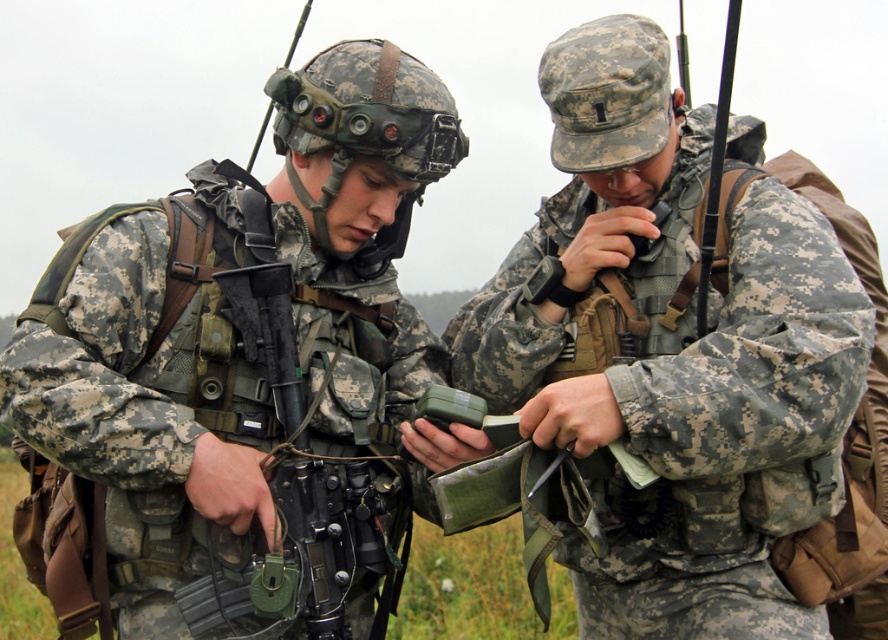
Question: Which is farther from the camouflage fabric radio at center?

Choices:
 (A) black matte rifle at center
 (B) camouflage uniform at center

Answer: (A)

Question: Can you confirm if camouflage fabric radio at center is positioned to the left of black matte rifle at center?

Choices:
 (A) yes
 (B) no

Answer: (B)

Question: Which point is closer to the camera?

Choices:
 (A) camouflage fabric radio at center
 (B) camouflage uniform at center
 (C) black matte rifle at center

Answer: (B)

Question: Considering the relative positions of camouflage fabric radio at center and black matte rifle at center in the image provided, where is camouflage fabric radio at center located with respect to black matte rifle at center?

Choices:
 (A) below
 (B) above

Answer: (B)

Question: Observing the image, what is the correct spatial positioning of camouflage uniform at center in reference to black matte rifle at center?

Choices:
 (A) below
 (B) above

Answer: (B)

Question: Estimate the real-world distances between objects in this image. Which object is farther from the black matte rifle at center?

Choices:
 (A) camouflage uniform at center
 (B) camouflage fabric radio at center

Answer: (B)